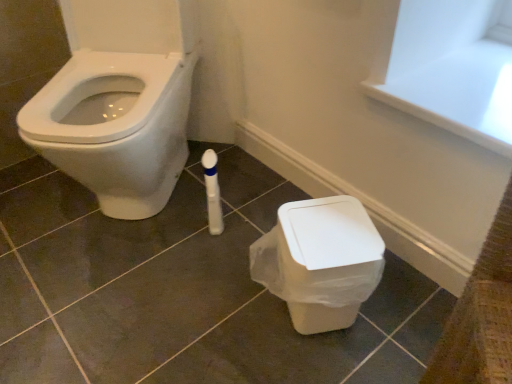
I want to click on vacant area located to the right-hand side of white glossy bidet at left, so pos(234,193).